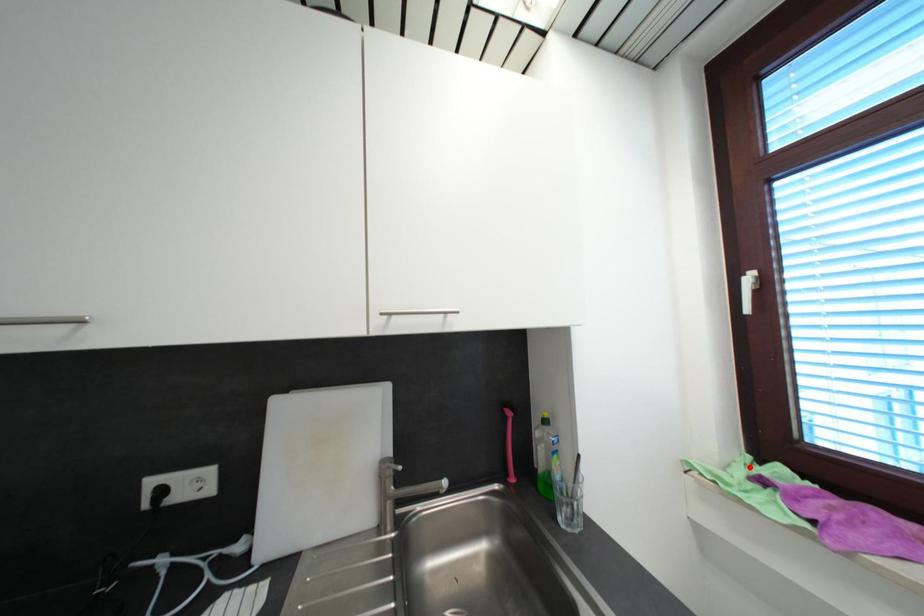
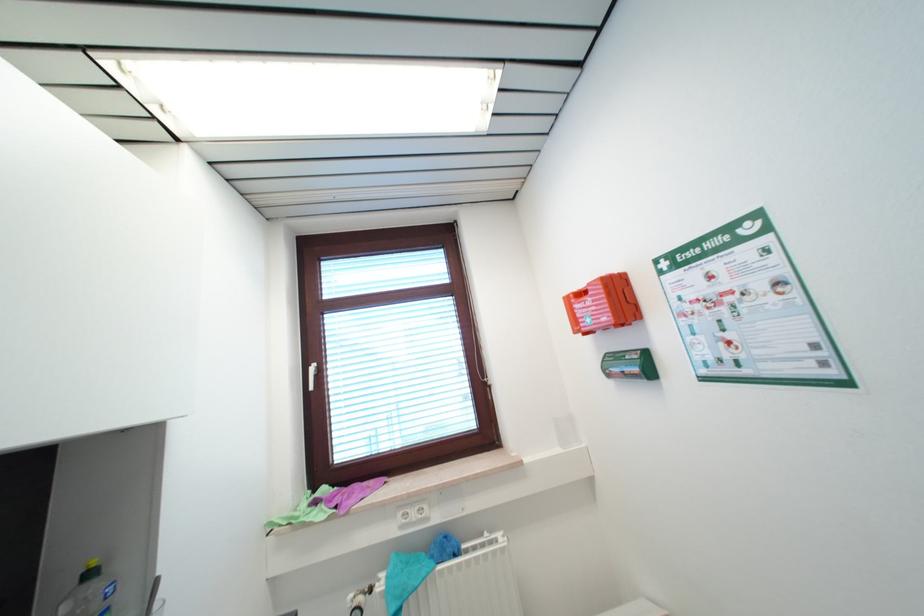
Where in the second image is the point corresponding to the highlighted location from the first image?

(311, 501)